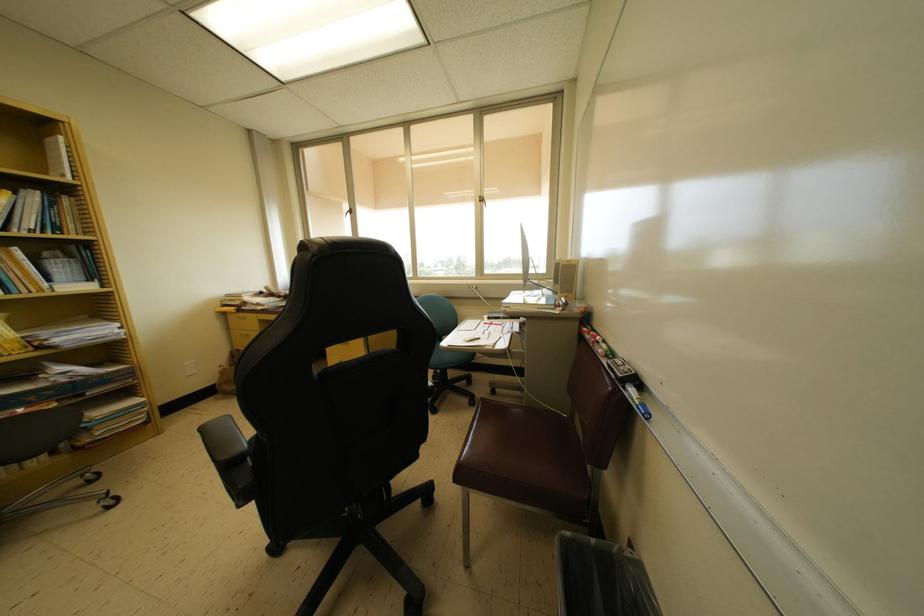
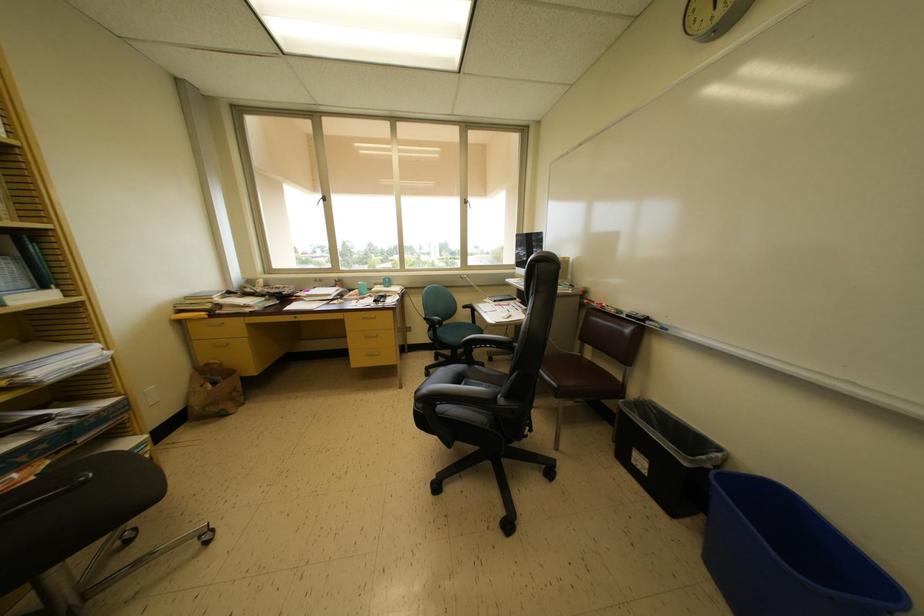
Question: In a continuous first-person perspective shot, in which direction is the camera moving?

Choices:
 (A) Left
 (B) Right
 (C) Forward
 (D) Backward

Answer: (A)